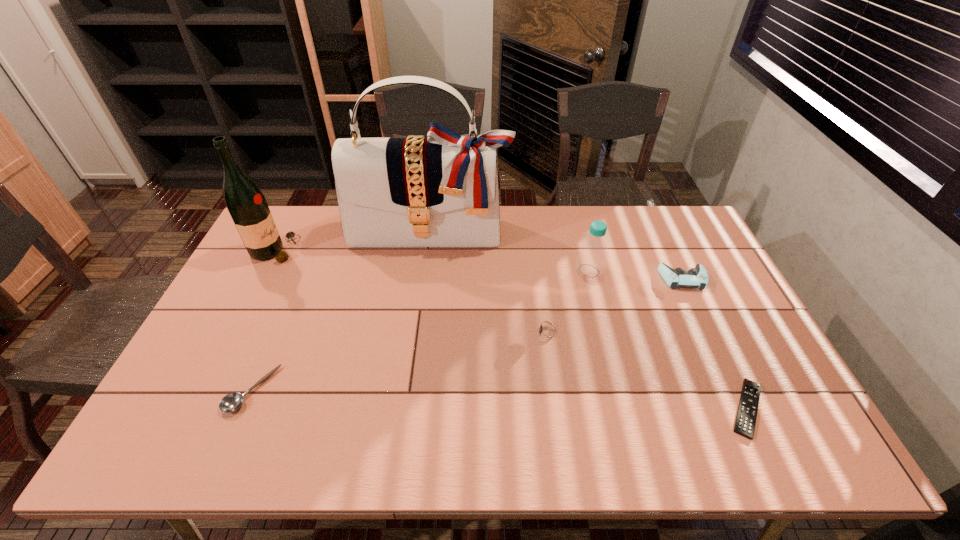
Locate an element on the screen. This screenshot has height=540, width=960. the tallest object is located at coordinates (442, 191).

Find the location of `satchel`. satchel is located at coordinates (442, 191).

The height and width of the screenshot is (540, 960). What are the coordinates of `wine bottle` in the screenshot? It's located at (248, 208).

Locate an element on the screen. The height and width of the screenshot is (540, 960). the third object from right to left is located at coordinates (592, 255).

Locate an element on the screen. This screenshot has width=960, height=540. the third tallest object is located at coordinates (592, 255).

Locate an element on the screen. the fourth tallest object is located at coordinates (697, 277).

Where is `the fourth object from left to right`? This screenshot has height=540, width=960. the fourth object from left to right is located at coordinates (547, 333).

Locate an element on the screen. watch is located at coordinates (547, 333).

This screenshot has height=540, width=960. Find the location of `ladle`. ladle is located at coordinates (231, 402).

Locate an element on the screen. Image resolution: width=960 pixels, height=540 pixels. the shortest object is located at coordinates (745, 421).